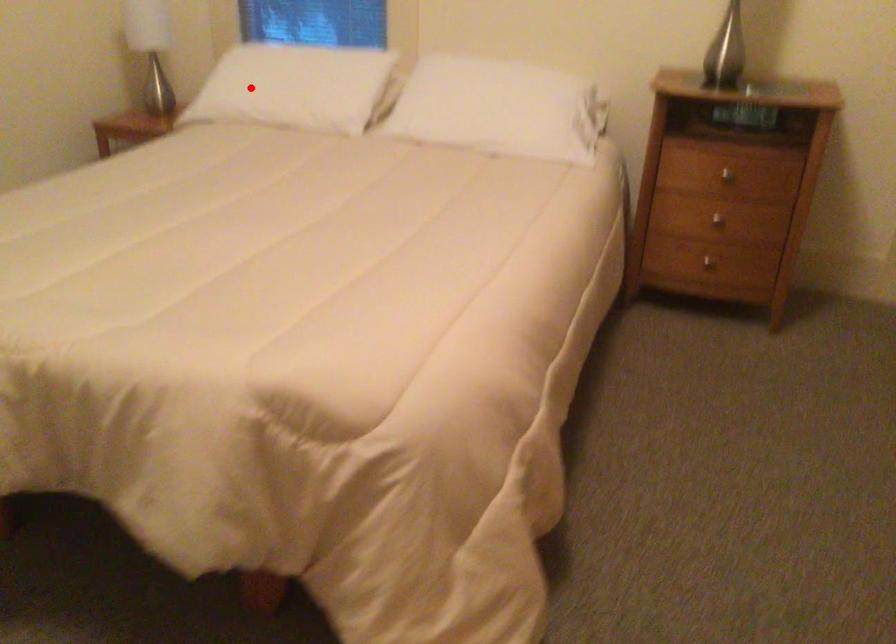
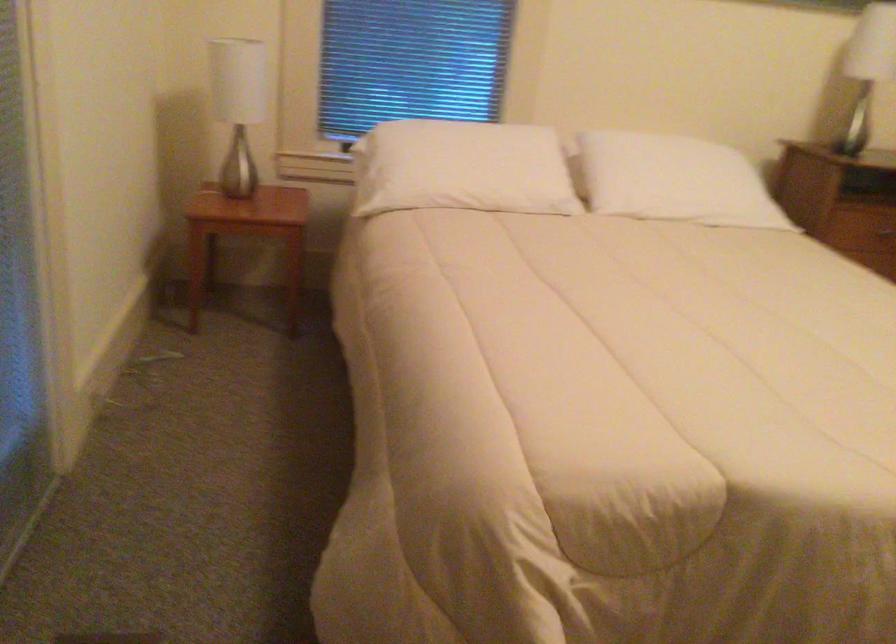
The point at the highlighted location is marked in the first image. Where is the corresponding point in the second image?

(462, 167)